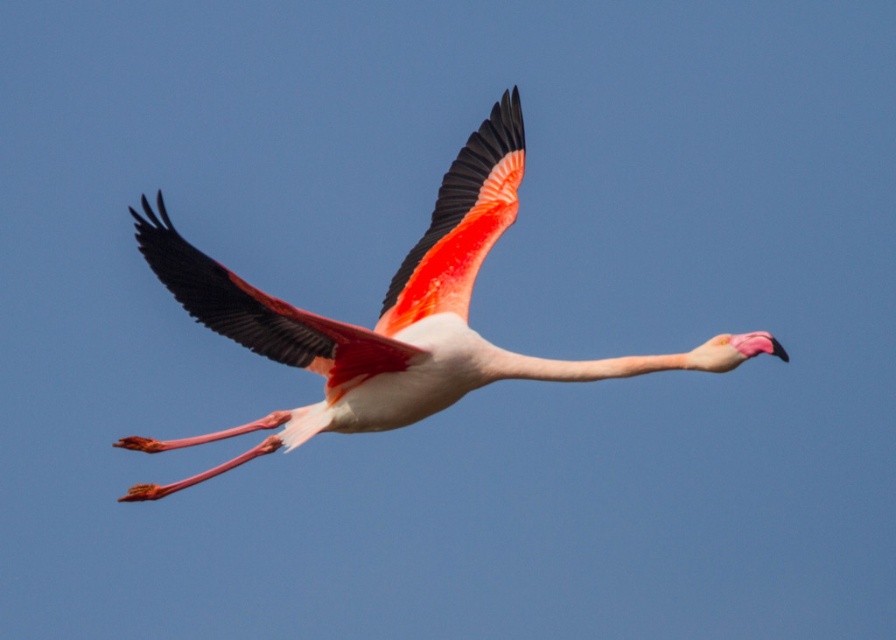
Question: Which object is positioned closest to the matte pink wing at center?

Choices:
 (A) vivid pink feathered wing at center
 (B) pink glossy flamingo at center

Answer: (B)

Question: Is pink glossy flamingo at center positioned in front of matte pink wing at center?

Choices:
 (A) yes
 (B) no

Answer: (B)

Question: Does pink glossy flamingo at center have a lesser width compared to matte pink wing at center?

Choices:
 (A) yes
 (B) no

Answer: (B)

Question: Does pink glossy flamingo at center have a greater width compared to vivid pink feathered wing at center?

Choices:
 (A) yes
 (B) no

Answer: (A)

Question: Estimate the real-world distances between objects in this image. Which object is farther from the matte pink wing at center?

Choices:
 (A) pink glossy flamingo at center
 (B) vivid pink feathered wing at center

Answer: (B)

Question: Considering the real-world distances, which object is farthest from the vivid pink feathered wing at center?

Choices:
 (A) pink glossy flamingo at center
 (B) matte pink wing at center

Answer: (B)